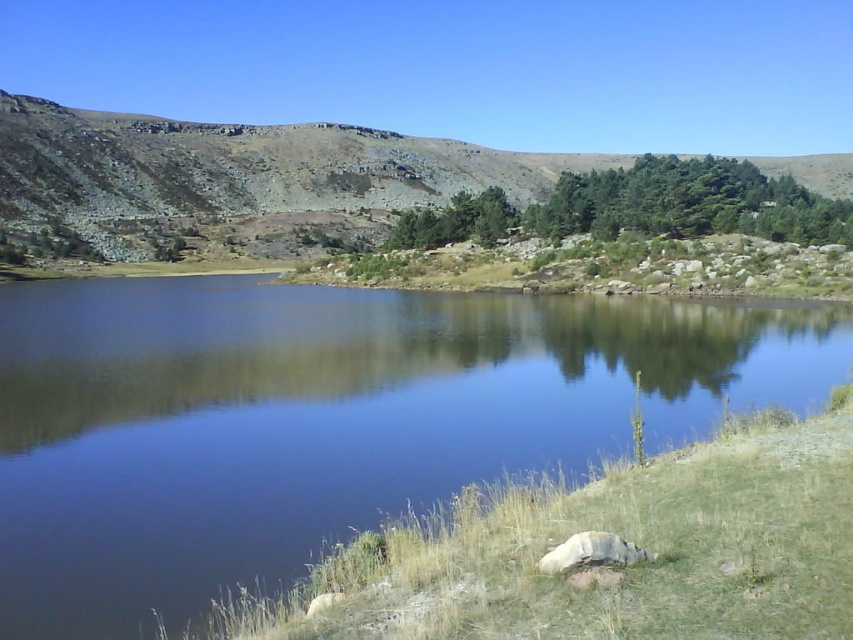
Who is more distant from viewer, (846, 496) or (292, 168)?

Point (292, 168)

Which is below, green grass at lower right or dull brown rock at upper left?

green grass at lower right is below.

The width and height of the screenshot is (853, 640). In order to click on green grass at lower right in this screenshot , I will do point(605,552).